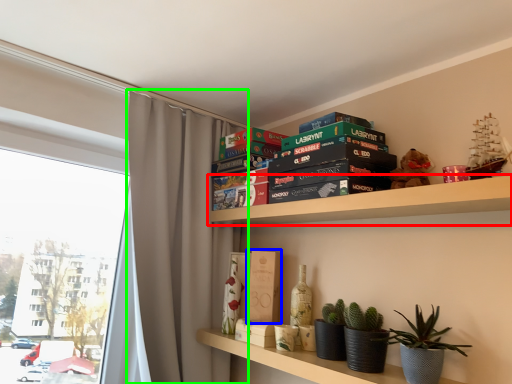
Question: Which is farther away from shelf (highlighted by a red box)? paperback book (highlighted by a blue box) or curtain (highlighted by a green box)?

Choices:
 (A) paperback book
 (B) curtain

Answer: (B)